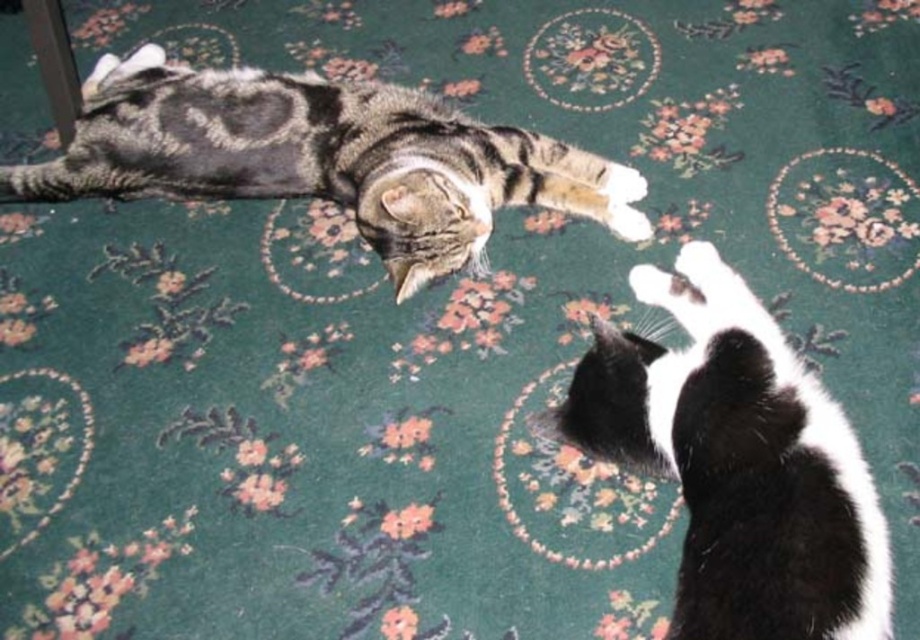
Question: Is black and white fur at lower right wider than tabby fur cat at upper left?

Choices:
 (A) no
 (B) yes

Answer: (A)

Question: Observing the image, what is the correct spatial positioning of black and white fur at lower right in reference to tabby fur cat at upper left?

Choices:
 (A) below
 (B) above

Answer: (A)

Question: Among these objects, which one is farthest from the camera?

Choices:
 (A) tabby fur cat at upper left
 (B) black and white fur at lower right

Answer: (A)

Question: Which point appears closest to the camera in this image?

Choices:
 (A) click(x=871, y=630)
 (B) click(x=188, y=108)

Answer: (A)

Question: Is black and white fur at lower right below tabby fur cat at upper left?

Choices:
 (A) no
 (B) yes

Answer: (B)